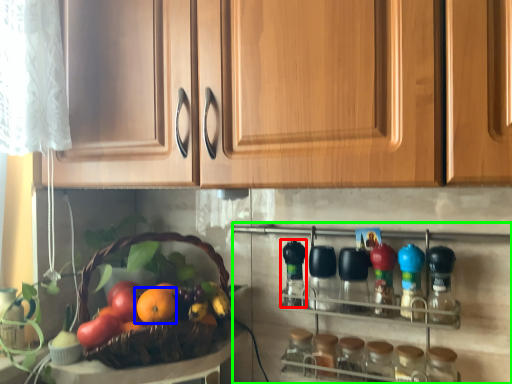
Question: Which is farther away from bottle (highlighted by a red box)? orange (highlighted by a blue box) or shelf (highlighted by a green box)?

Choices:
 (A) orange
 (B) shelf

Answer: (A)